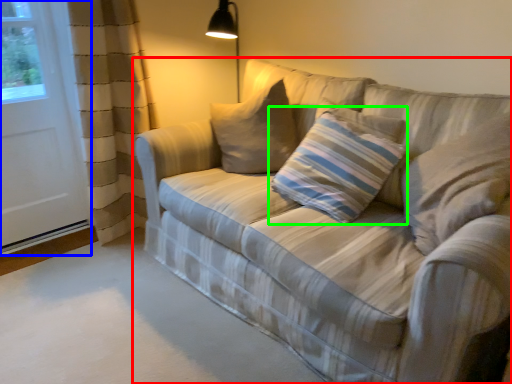
Question: Which object is positioned closest to studio couch (highlighted by a red box)? Select from screen door (highlighted by a blue box) and pillow (highlighted by a green box).

Choices:
 (A) screen door
 (B) pillow

Answer: (B)